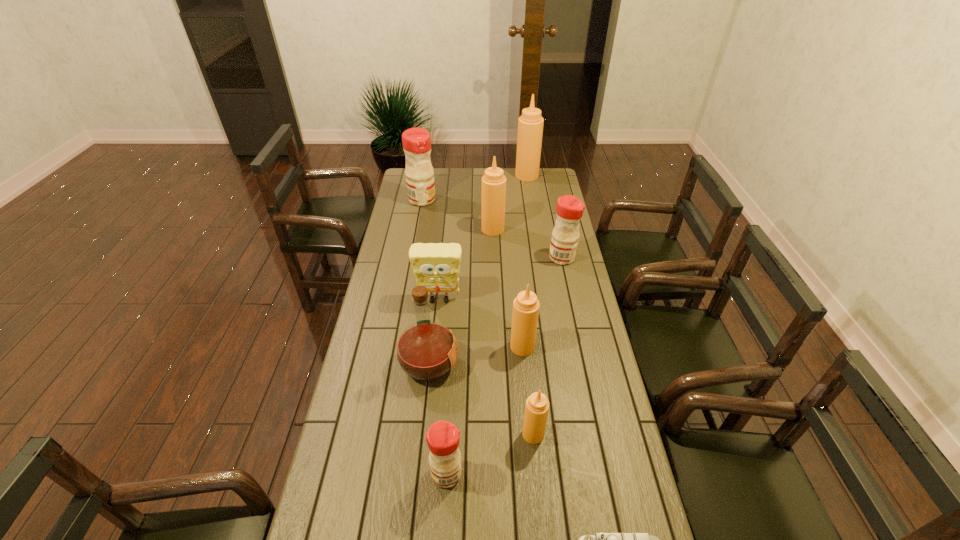
The width and height of the screenshot is (960, 540). Identify the location of vacant area situated 0.110m on the right of the second smallest tan condiment. (565, 347).

Identify the location of free space located on the back of the second smallest red condiment. This screenshot has height=540, width=960. (558, 237).

Locate an element on the screen. The height and width of the screenshot is (540, 960). free location located 0.120m on the face of the sponge is located at coordinates (436, 333).

You are a GUI agent. You are given a task and a screenshot of the screen. Output one action in this format:
    pyautogui.click(x=<x>, y=<y>)
    Task: Click on the blank space located 0.170m on the right of the second nearest condiment
    The image size is (960, 540).
    Given the screenshot: What is the action you would take?
    pyautogui.click(x=601, y=434)

Find the location of a particular element. This screenshot has height=540, width=960. blank space located on the back of the nearest red condiment is located at coordinates (451, 393).

Identify the location of object at the far edge. The height and width of the screenshot is (540, 960). (530, 124).

Locate an element on the screen. The image size is (960, 540). condiment located in the left edge section of the desktop is located at coordinates (416, 141).

Locate an element on the screen. This screenshot has width=960, height=540. liquor situated at the left edge is located at coordinates (426, 350).

Locate an element on the screen. This screenshot has width=960, height=540. object situated at the far right corner is located at coordinates (530, 124).

In the image, there is a desktop. At what (x,y) coordinates should I click in order to perform the action: click on blank space at the left edge. Please return your answer as a coordinate pair (x, y). The height and width of the screenshot is (540, 960). Looking at the image, I should click on (379, 425).